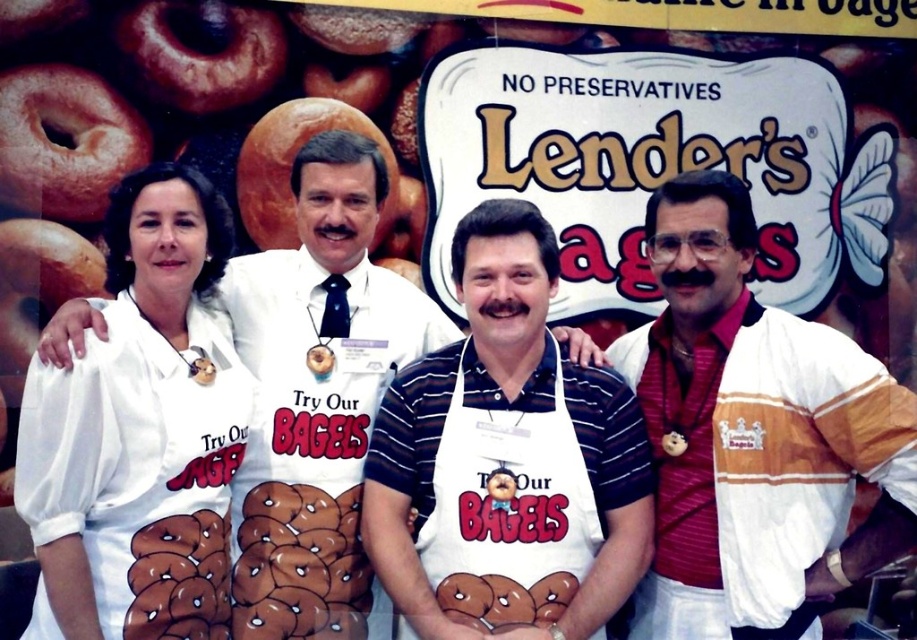
You are standing in front of the Lender Bagel promotional backdrop. Where is the white fabric apron at left located in terms of its 2D coordinates?

The white fabric apron at left is located at the 2D coordinates point (x=139, y=433).

You are standing in front of the Lender Bagel promotional backdrop and see two points marked in the image. Which point is closer to you, point (737, 413) or point (130, 209)?

Point (737, 413) is closer to the viewer than point (130, 209).